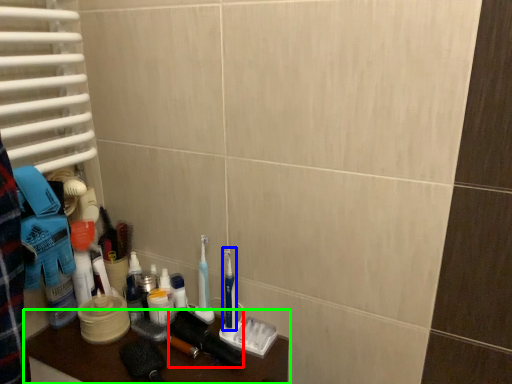
Question: Which object is the farthest from brush (highlighted by a red box)? Choose among these: toothbrush (highlighted by a blue box) or furniture (highlighted by a green box).

Choices:
 (A) toothbrush
 (B) furniture

Answer: (B)